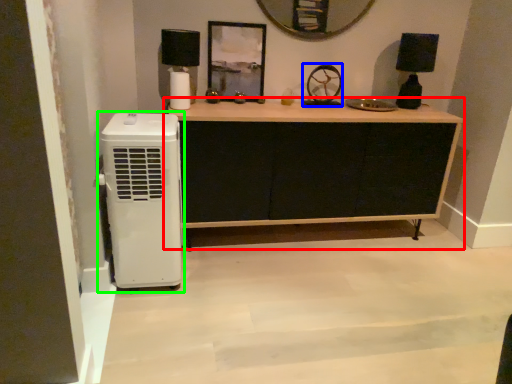
Question: Which object is the farthest from chest of drawers (highlighted by a red box)? Choose among these: wheel (highlighted by a blue box) or home appliance (highlighted by a green box).

Choices:
 (A) wheel
 (B) home appliance

Answer: (B)